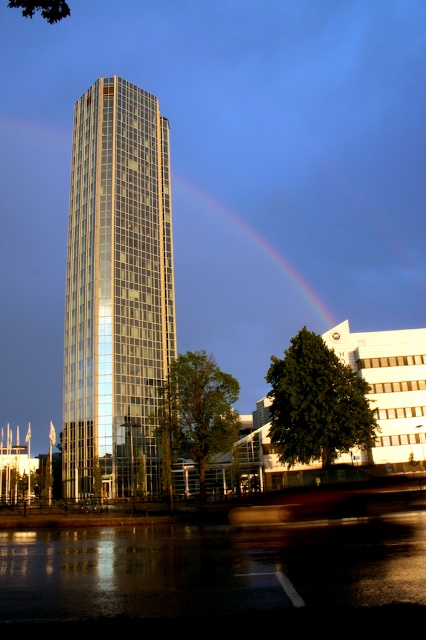
Question: Which point is farther to the camera?

Choices:
 (A) glassy metallic tower at center
 (B) rainbow at center

Answer: (B)

Question: Which object is closer to the camera taking this photo?

Choices:
 (A) rainbow at center
 (B) glassy metallic tower at center

Answer: (B)

Question: Does glassy metallic tower at center lie behind rainbow at center?

Choices:
 (A) yes
 (B) no

Answer: (B)

Question: Does glassy metallic tower at center appear over rainbow at center?

Choices:
 (A) yes
 (B) no

Answer: (B)

Question: Does glassy metallic tower at center appear on the right side of rainbow at center?

Choices:
 (A) yes
 (B) no

Answer: (B)